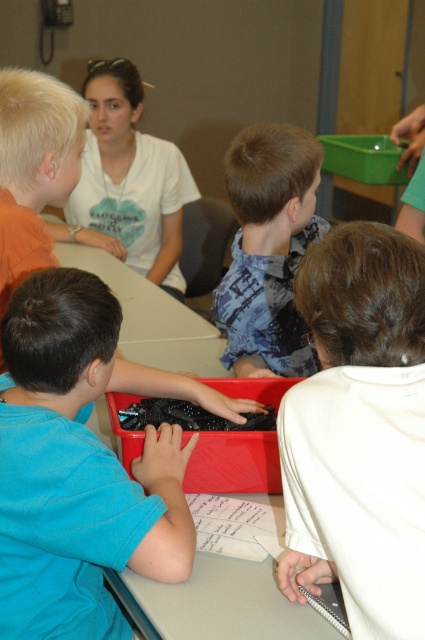
Does blue printed shirt at center have a smaller size compared to white matte shirt at upper center?

Indeed, blue printed shirt at center has a smaller size compared to white matte shirt at upper center.

Can you confirm if blue printed shirt at center is shorter than white matte shirt at upper center?

Indeed, blue printed shirt at center has a lesser height compared to white matte shirt at upper center.

Find the location of a particular element. Image resolution: width=425 pixels, height=640 pixels. blue printed shirt at center is located at coordinates (269, 250).

Which is above, blue matte shirt at center or white matte notebook at lower right?

white matte notebook at lower right is above.

Describe the element at coordinates (81, 467) in the screenshot. I see `blue matte shirt at center` at that location.

Measure the distance between blue matte shirt at center and camera.

The distance of blue matte shirt at center from camera is 1.13 meters.

Where is `blue matte shirt at center`? This screenshot has height=640, width=425. blue matte shirt at center is located at coordinates (81, 467).

Which of these two, blue matte shirt at center or white matte shirt at upper center, stands taller?

With more height is white matte shirt at upper center.

Who is higher up, blue matte shirt at center or white matte shirt at upper center?

white matte shirt at upper center

Which is behind, point (17, 332) or point (108, 134)?

Positioned behind is point (108, 134).

The height and width of the screenshot is (640, 425). I want to click on blue matte shirt at center, so click(x=81, y=467).